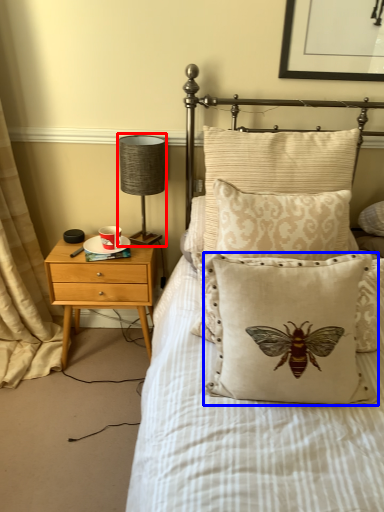
Question: Among these objects, which one is farthest to the camera, table lamp (highlighted by a red box) or pillow (highlighted by a blue box)?

Choices:
 (A) table lamp
 (B) pillow

Answer: (A)